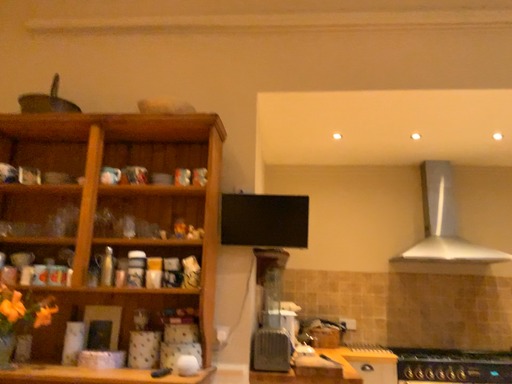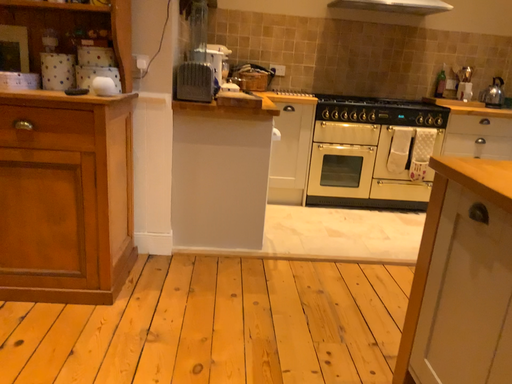
Question: Which way did the camera rotate in the video?

Choices:
 (A) rotated upward
 (B) rotated downward

Answer: (B)